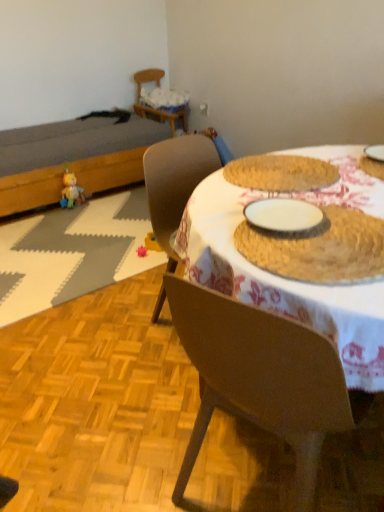
Question: Is dark brown wooden bed at left completely or partially inside wooden chair at upper left, the 2th chair from the front?

Choices:
 (A) yes
 (B) no

Answer: (B)

Question: Can you confirm if wooden chair at upper left, which is counted as the 1th chair, starting from the top, is bigger than dark brown wooden bed at left?

Choices:
 (A) no
 (B) yes

Answer: (A)

Question: Is wooden chair at upper left, which is counted as the 1th chair, starting from the top, turned away from dark brown wooden bed at left?

Choices:
 (A) yes
 (B) no

Answer: (B)

Question: From the image's perspective, is wooden chair at upper left, which appears as the first chair when viewed from the left, over dark brown wooden bed at left?

Choices:
 (A) no
 (B) yes

Answer: (B)

Question: Is wooden chair at upper left, the 2th chair from the front, positioned beyond the bounds of dark brown wooden bed at left?

Choices:
 (A) yes
 (B) no

Answer: (A)

Question: Considering the relative sizes of wooden chair at upper left, which is the 2th chair from bottom to top, and dark brown wooden bed at left in the image provided, is wooden chair at upper left, which is the 2th chair from bottom to top, shorter than dark brown wooden bed at left?

Choices:
 (A) no
 (B) yes

Answer: (A)

Question: Can you confirm if plush yellow duck at left, which is counted as the first toy, starting from the left, is smaller than white woven placemat at left?

Choices:
 (A) yes
 (B) no

Answer: (A)

Question: Does plush yellow duck at left, which is counted as the first toy, starting from the left, lie behind white woven placemat at left?

Choices:
 (A) no
 (B) yes

Answer: (B)

Question: Could you tell me if plush yellow duck at left, positioned as the 1th toy in top-to-bottom order, is turned towards white woven placemat at left?

Choices:
 (A) no
 (B) yes

Answer: (B)

Question: Considering the relative positions of plush yellow duck at left, which is the second toy from front to back, and white woven placemat at left in the image provided, is plush yellow duck at left, which is the second toy from front to back, in front of white woven placemat at left?

Choices:
 (A) yes
 (B) no

Answer: (B)

Question: Can you confirm if plush yellow duck at left, which is counted as the first toy, starting from the left, is bigger than white woven placemat at left?

Choices:
 (A) yes
 (B) no

Answer: (B)

Question: Is plush yellow duck at left, the 1th toy when ordered from back to front, to the right of white woven placemat at left from the viewer's perspective?

Choices:
 (A) no
 (B) yes

Answer: (A)

Question: Is brown woven placemat at center positioned far away from brown wood table at center?

Choices:
 (A) no
 (B) yes

Answer: (A)